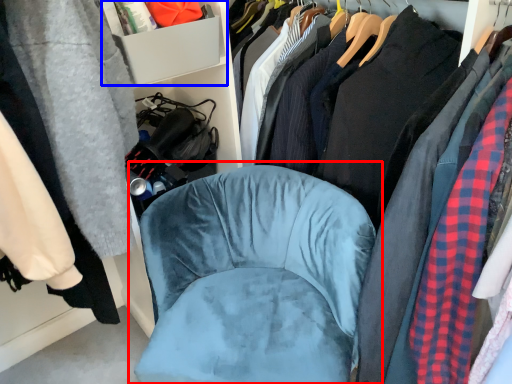
Question: Which object appears farthest to the camera in this image, chair (highlighted by a red box) or cabinet (highlighted by a blue box)?

Choices:
 (A) chair
 (B) cabinet

Answer: (B)